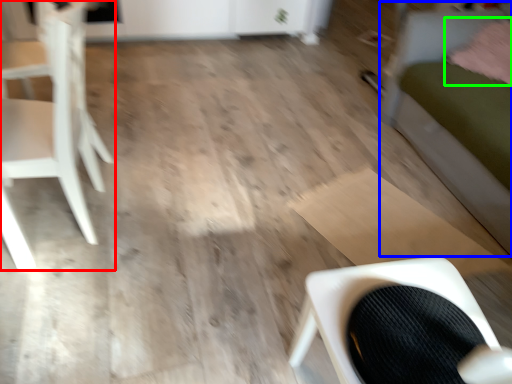
Question: Which object is the closest to the chair (highlighted by a red box)? Choose among these: bed (highlighted by a blue box) or pillow (highlighted by a green box).

Choices:
 (A) bed
 (B) pillow

Answer: (A)